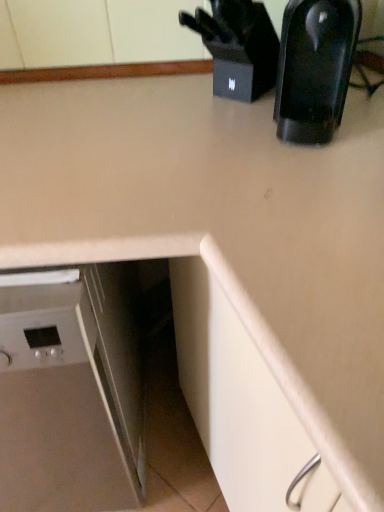
The height and width of the screenshot is (512, 384). In order to click on white glossy dishwasher at lower left in this screenshot , I will do `click(70, 391)`.

Describe the element at coordinates (70, 391) in the screenshot. I see `white glossy dishwasher at lower left` at that location.

Identify the location of black plastic knife block at upper right. This screenshot has height=512, width=384. pyautogui.click(x=238, y=47).

Which object is thinner, white glossy dishwasher at lower left or black glossy coffee maker at upper right?

black glossy coffee maker at upper right.

Is white glossy dishwasher at lower left outside of black glossy coffee maker at upper right?

Absolutely, white glossy dishwasher at lower left is external to black glossy coffee maker at upper right.

Can you confirm if white glossy dishwasher at lower left is smaller than black glossy coffee maker at upper right?

No.

From the image's perspective, is white glossy dishwasher at lower left positioned above or below black glossy coffee maker at upper right?

Based on their image positions, white glossy dishwasher at lower left is located beneath black glossy coffee maker at upper right.

From a real-world perspective, is black plastic knife block at upper right positioned under black glossy coffee maker at upper right based on gravity?

Yes, from a real-world perspective, black plastic knife block at upper right is below black glossy coffee maker at upper right.

Considering the positions of point (235, 88) and point (328, 9), is point (235, 88) closer or farther from the camera than point (328, 9)?

Point (235, 88).

What's the angular difference between black plastic knife block at upper right and black glossy coffee maker at upper right's facing directions?

The facing directions of black plastic knife block at upper right and black glossy coffee maker at upper right are 40.4 degrees apart.

In the scene shown: From the image's perspective, between black glossy coffee maker at upper right and white glossy dishwasher at lower left, who is located below?

From the image's view, white glossy dishwasher at lower left is below.

Is black glossy coffee maker at upper right next to white glossy dishwasher at lower left and touching it?

No, black glossy coffee maker at upper right is not beside white glossy dishwasher at lower left.

Is white glossy dishwasher at lower left a part of black glossy coffee maker at upper right?

No, white glossy dishwasher at lower left is not surrounded by black glossy coffee maker at upper right.

Are black glossy coffee maker at upper right and black plastic knife block at upper right making contact?

black glossy coffee maker at upper right and black plastic knife block at upper right are not in contact.

Is black glossy coffee maker at upper right turned away from black plastic knife block at upper right?

No, black glossy coffee maker at upper right is not facing away from black plastic knife block at upper right.

From a real-world perspective, who is located lower, black glossy coffee maker at upper right or black plastic knife block at upper right?

black plastic knife block at upper right.

Can you confirm if black plastic knife block at upper right is positioned to the left of white glossy dishwasher at lower left?

Incorrect, black plastic knife block at upper right is not on the left side of white glossy dishwasher at lower left.

Which is behind, black plastic knife block at upper right or white glossy dishwasher at lower left?

black plastic knife block at upper right is more distant.

Is black plastic knife block at upper right far away from white glossy dishwasher at lower left?

That's not correct — black plastic knife block at upper right is a little close to white glossy dishwasher at lower left.

Is black plastic knife block at upper right taller or shorter than white glossy dishwasher at lower left?

Considering their sizes, black plastic knife block at upper right has less height than white glossy dishwasher at lower left.

From the image's perspective, is white glossy dishwasher at lower left beneath black plastic knife block at upper right?

Correct, white glossy dishwasher at lower left appears lower than black plastic knife block at upper right in the image.

Is point (93, 488) closer or farther from the camera than point (266, 67)?

Point (93, 488).

Can you confirm if white glossy dishwasher at lower left is positioned to the left of black plastic knife block at upper right?

Indeed, white glossy dishwasher at lower left is positioned on the left side of black plastic knife block at upper right.

In the image, there is a white glossy dishwasher at lower left. Find the location of `kitchen appliance above it (from the image's perspective)`. kitchen appliance above it (from the image's perspective) is located at coordinates (315, 68).

Locate an element on the screen. The width and height of the screenshot is (384, 512). kitchen appliance below the black plastic knife block at upper right (from the image's perspective) is located at coordinates (315, 68).

From the image, which object appears to be farther from white glossy dishwasher at lower left, black glossy coffee maker at upper right or black plastic knife block at upper right?

black plastic knife block at upper right is further to white glossy dishwasher at lower left.

Which object lies further to the anchor point black glossy coffee maker at upper right, white glossy dishwasher at lower left or black plastic knife block at upper right?

Among the two, white glossy dishwasher at lower left is located further to black glossy coffee maker at upper right.

When comparing their distances from black plastic knife block at upper right, does black glossy coffee maker at upper right or white glossy dishwasher at lower left seem further?

white glossy dishwasher at lower left lies further to black plastic knife block at upper right than the other object.

In the scene shown: Considering their positions, is black plastic knife block at upper right positioned closer to white glossy dishwasher at lower left than black glossy coffee maker at upper right?

Among the two, black glossy coffee maker at upper right is located nearer to white glossy dishwasher at lower left.

Based on their spatial positions, is black plastic knife block at upper right or white glossy dishwasher at lower left closer to black glossy coffee maker at upper right?

black plastic knife block at upper right is positioned closer to the anchor black glossy coffee maker at upper right.

Considering their positions, is white glossy dishwasher at lower left positioned closer to black plastic knife block at upper right than black glossy coffee maker at upper right?

black glossy coffee maker at upper right is positioned closer to the anchor black plastic knife block at upper right.

Identify the location of appliance located between white glossy dishwasher at lower left and black glossy coffee maker at upper right in the left-right direction. pos(238,47).